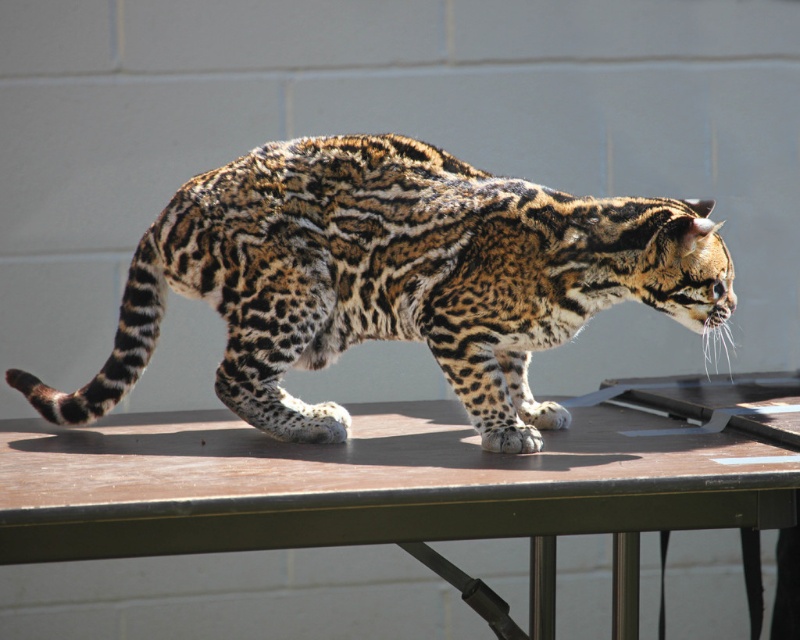
Question: From the image, what is the correct spatial relationship of leopard print fur cat at center in relation to brown wood table at center?

Choices:
 (A) below
 (B) above

Answer: (B)

Question: Is leopard print fur cat at center below brown wood table at center?

Choices:
 (A) no
 (B) yes

Answer: (A)

Question: Can you confirm if leopard print fur cat at center is bigger than brown wood table at center?

Choices:
 (A) yes
 (B) no

Answer: (B)

Question: Among these points, which one is farthest from the camera?

Choices:
 (A) [x=492, y=426]
 (B) [x=444, y=452]

Answer: (A)